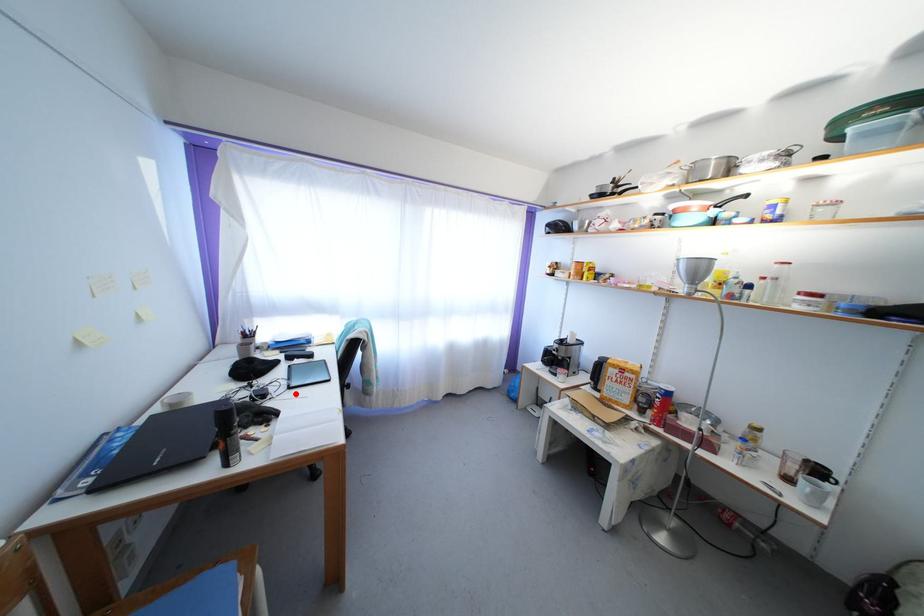
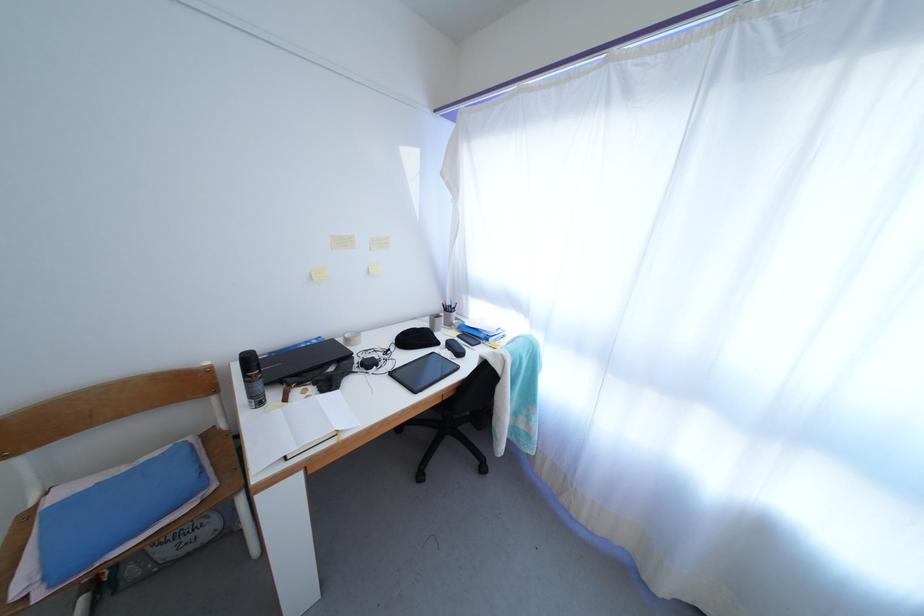
Where in the second image is the point corresponding to the highlighted location from the first image?

(397, 379)